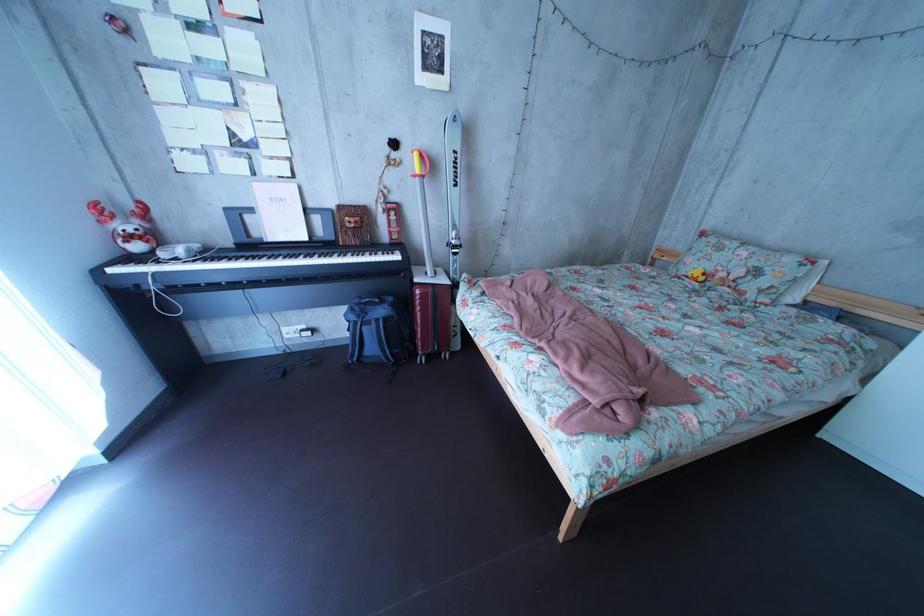
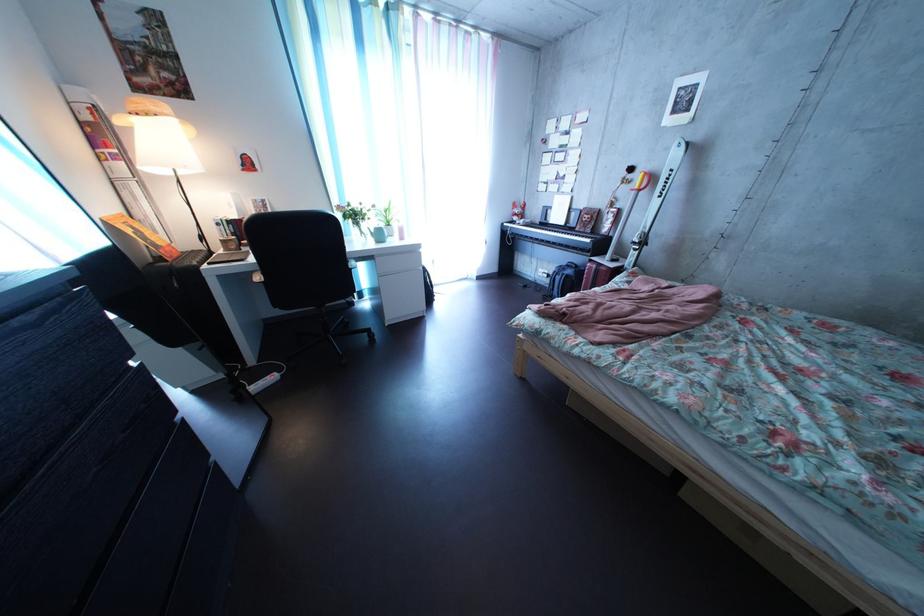
Where in the second image is the point corresponding to the point at 468,254 from the first image?

(648, 252)